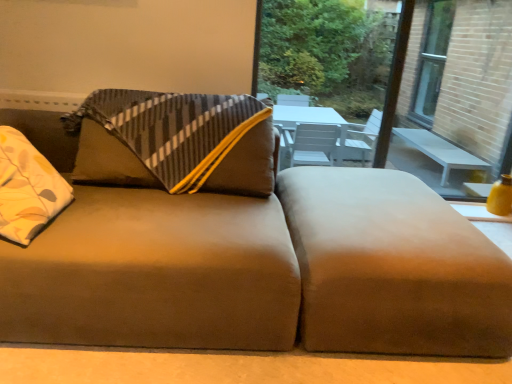
Question: Is suede brown couch at center positioned with its back to transparent glass window at upper right?

Choices:
 (A) yes
 (B) no

Answer: (B)

Question: From the image's perspective, is suede brown couch at center on top of transparent glass window at upper right?

Choices:
 (A) no
 (B) yes

Answer: (A)

Question: Does suede brown couch at center have a larger size compared to transparent glass window at upper right?

Choices:
 (A) no
 (B) yes

Answer: (B)

Question: Is suede brown couch at center closer to camera compared to transparent glass window at upper right?

Choices:
 (A) yes
 (B) no

Answer: (A)

Question: From the image's perspective, does suede brown couch at center appear lower than transparent glass window at upper right?

Choices:
 (A) yes
 (B) no

Answer: (A)

Question: Considering the relative positions of suede brown couch at center and transparent glass window at upper right in the image provided, is suede brown couch at center to the left of transparent glass window at upper right from the viewer's perspective?

Choices:
 (A) no
 (B) yes

Answer: (B)

Question: Is suede brown couch at center positioned beyond the bounds of suede-like brown footrest at lower right?

Choices:
 (A) no
 (B) yes

Answer: (B)

Question: Is suede brown couch at center further to camera compared to suede-like brown footrest at lower right?

Choices:
 (A) no
 (B) yes

Answer: (A)

Question: Is suede brown couch at center to the right of suede-like brown footrest at lower right from the viewer's perspective?

Choices:
 (A) no
 (B) yes

Answer: (A)

Question: Would you say suede brown couch at center is a long distance from suede-like brown footrest at lower right?

Choices:
 (A) yes
 (B) no

Answer: (B)

Question: Can you confirm if suede brown couch at center is thinner than suede-like brown footrest at lower right?

Choices:
 (A) no
 (B) yes

Answer: (B)

Question: Is suede brown couch at center to the left of suede-like brown footrest at lower right from the viewer's perspective?

Choices:
 (A) no
 (B) yes

Answer: (B)

Question: From a real-world perspective, is suede-like brown footrest at lower right below transparent glass window at upper right?

Choices:
 (A) yes
 (B) no

Answer: (A)